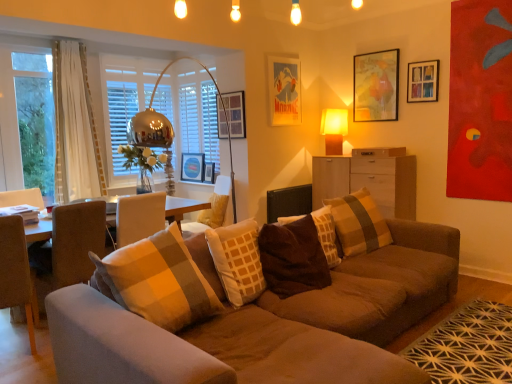
Question: Is white sheer curtain at left further to the viewer compared to white wood drawer at center?

Choices:
 (A) yes
 (B) no

Answer: (B)

Question: Can you confirm if white sheer curtain at left is taller than white wood drawer at center?

Choices:
 (A) yes
 (B) no

Answer: (A)

Question: Is white sheer curtain at left positioned with its back to white wood drawer at center?

Choices:
 (A) no
 (B) yes

Answer: (A)

Question: Is white sheer curtain at left bigger than white wood drawer at center?

Choices:
 (A) yes
 (B) no

Answer: (A)

Question: Considering the relative sizes of white sheer curtain at left and white wood drawer at center in the image provided, is white sheer curtain at left wider than white wood drawer at center?

Choices:
 (A) no
 (B) yes

Answer: (A)

Question: From the image's perspective, is light brown wood cabinet at center right located above or below transparent glass window at left?

Choices:
 (A) below
 (B) above

Answer: (A)

Question: Considering the positions of light brown wood cabinet at center right and transparent glass window at left in the image, is light brown wood cabinet at center right taller or shorter than transparent glass window at left?

Choices:
 (A) tall
 (B) short

Answer: (B)

Question: In the image, is light brown wood cabinet at center right positioned in front of or behind transparent glass window at left?

Choices:
 (A) behind
 (B) front

Answer: (B)

Question: Is light brown wood cabinet at center right bigger or smaller than transparent glass window at left?

Choices:
 (A) small
 (B) big

Answer: (B)

Question: Is brown fabric swivel chair at left inside the boundaries of metallic glass vase at left, or outside?

Choices:
 (A) outside
 (B) inside

Answer: (A)

Question: Relative to metallic glass vase at left, is brown fabric swivel chair at left in front or behind?

Choices:
 (A) front
 (B) behind

Answer: (A)

Question: Is brown fabric swivel chair at left wider or thinner than metallic glass vase at left?

Choices:
 (A) wide
 (B) thin

Answer: (A)

Question: From a real-world perspective, is brown fabric swivel chair at left positioned above or below metallic glass vase at left?

Choices:
 (A) above
 (B) below

Answer: (B)

Question: Would you say beige fabric armchair at center is inside or outside wooden map at upper right, acting as the 2th picture frame starting from the right?

Choices:
 (A) inside
 (B) outside

Answer: (B)

Question: Considering their positions, is beige fabric armchair at center located in front of or behind wooden map at upper right, acting as the 2th picture frame starting from the right?

Choices:
 (A) front
 (B) behind

Answer: (A)